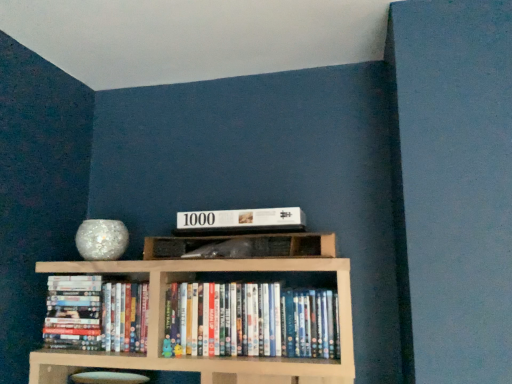
Question: Are wooden shelf at center and white matte puzzle box at center beside each other?

Choices:
 (A) no
 (B) yes

Answer: (B)

Question: Is wooden shelf at center at the left side of white matte puzzle box at center?

Choices:
 (A) no
 (B) yes

Answer: (A)

Question: From a real-world perspective, is wooden shelf at center physically above white matte puzzle box at center?

Choices:
 (A) yes
 (B) no

Answer: (B)

Question: Is the position of wooden shelf at center less distant than that of white matte puzzle box at center?

Choices:
 (A) yes
 (B) no

Answer: (A)

Question: Can you confirm if wooden shelf at center is taller than white matte puzzle box at center?

Choices:
 (A) no
 (B) yes

Answer: (B)

Question: Considering the positions of white matte puzzle box at center and hardcover books at center, placed as the 1th book when sorted from left to right, in the image, is white matte puzzle box at center taller or shorter than hardcover books at center, placed as the 1th book when sorted from left to right,?

Choices:
 (A) tall
 (B) short

Answer: (B)

Question: From a real-world perspective, is white matte puzzle box at center positioned above or below hardcover books at center, placed as the 1th book when sorted from left to right?

Choices:
 (A) below
 (B) above

Answer: (B)

Question: Looking at the image, does white matte puzzle box at center seem bigger or smaller compared to hardcover books at center, acting as the 2th book starting from the right?

Choices:
 (A) big
 (B) small

Answer: (B)

Question: Considering the relative positions of white matte puzzle box at center and hardcover books at center, acting as the 2th book starting from the right, in the image provided, is white matte puzzle box at center to the left or to the right of hardcover books at center, acting as the 2th book starting from the right,?

Choices:
 (A) left
 (B) right

Answer: (B)

Question: Is white glossy dvd case at center, acting as the 2th book starting from the left, situated inside wooden shelf at center or outside?

Choices:
 (A) inside
 (B) outside

Answer: (B)

Question: Is white glossy dvd case at center, the first book when ordered from right to left, taller or shorter than wooden shelf at center?

Choices:
 (A) tall
 (B) short

Answer: (A)

Question: From the image's perspective, is white glossy dvd case at center, acting as the 2th book starting from the left, located above or below wooden shelf at center?

Choices:
 (A) above
 (B) below

Answer: (B)

Question: Is white glossy dvd case at center, acting as the 2th book starting from the left, to the left or to the right of wooden shelf at center in the image?

Choices:
 (A) left
 (B) right

Answer: (B)

Question: Is point (93, 283) positioned closer to the camera than point (330, 241)?

Choices:
 (A) farther
 (B) closer

Answer: (A)

Question: Based on their positions, is hardcover books at center, placed as the 1th book when sorted from left to right, located to the left or right of wooden shelf at center?

Choices:
 (A) left
 (B) right

Answer: (A)